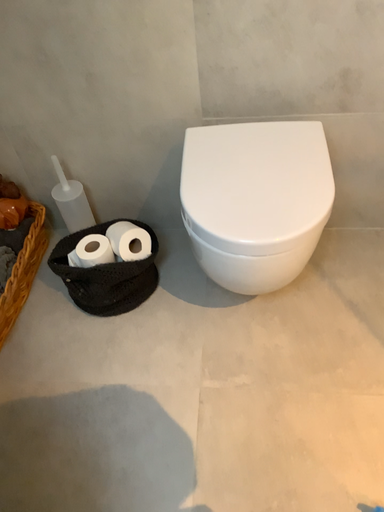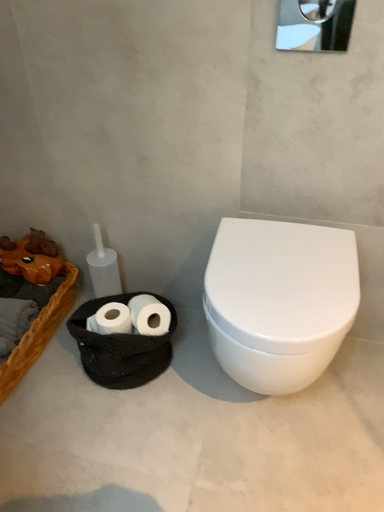
Question: How did the camera likely rotate when shooting the video?

Choices:
 (A) rotated upward
 (B) rotated downward

Answer: (A)